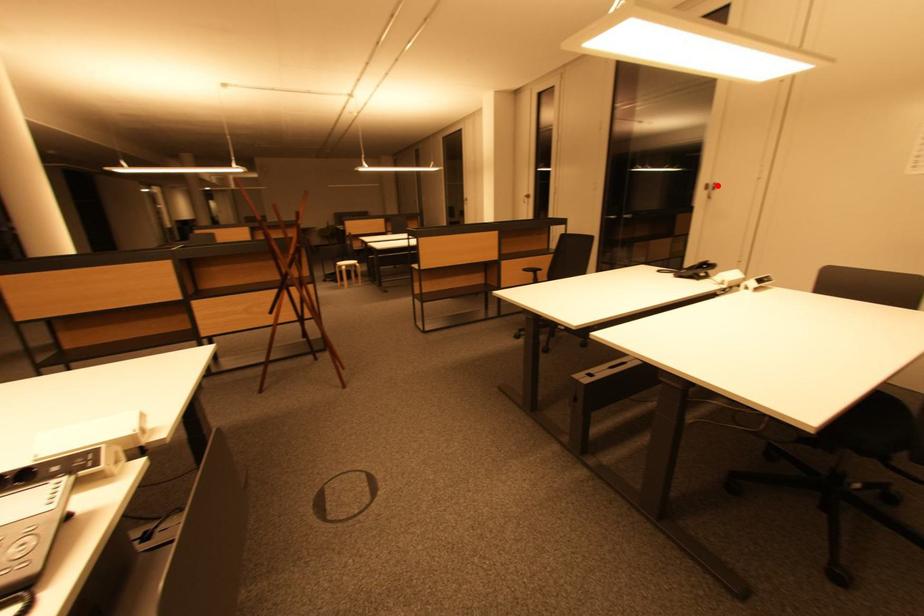
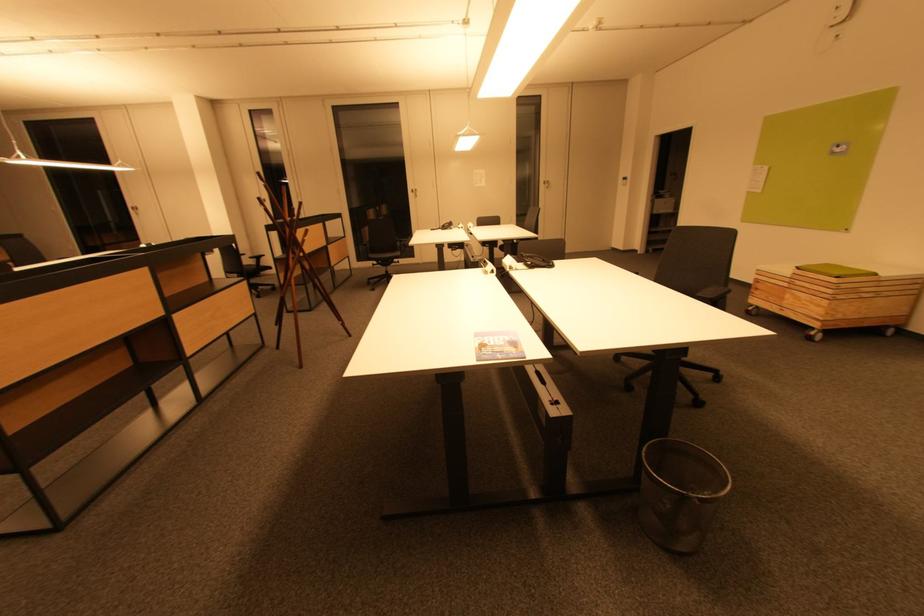
Question: I am providing you with two images of the same scene from different viewpoints. A red point is marked on the first image. Can you still see the location of the red point in image 2?

Choices:
 (A) Yes
 (B) No

Answer: (A)